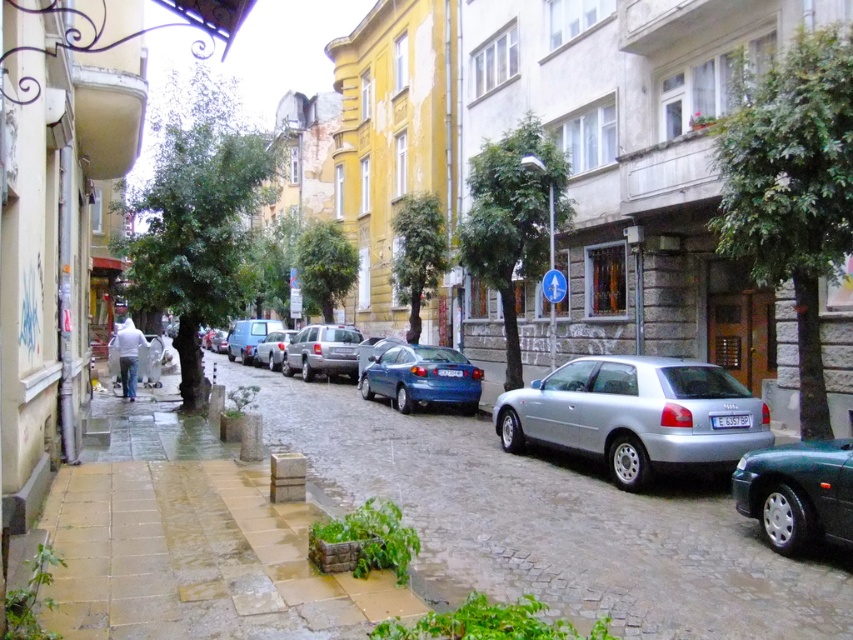
Question: Among these points, which one is farthest from the camera?

Choices:
 (A) (229, 355)
 (B) (704, 403)

Answer: (A)

Question: Does brown stone pavement at center have a larger size compared to silver metallic hatchback at center?

Choices:
 (A) no
 (B) yes

Answer: (B)

Question: Which point is closer to the camera taking this photo?

Choices:
 (A) (749, 397)
 (B) (270, 368)
 (C) (766, 538)
 (D) (254, 326)

Answer: (C)

Question: Which point is farther to the camera?

Choices:
 (A) (283, 330)
 (B) (461, 440)
 (C) (738, 484)

Answer: (A)

Question: Is glossy blue sedan at center thinner than silver metallic hatchback at center?

Choices:
 (A) no
 (B) yes

Answer: (A)

Question: Can you confirm if metallic green car at lower right is smaller than silver metallic hatchback at center?

Choices:
 (A) yes
 (B) no

Answer: (A)